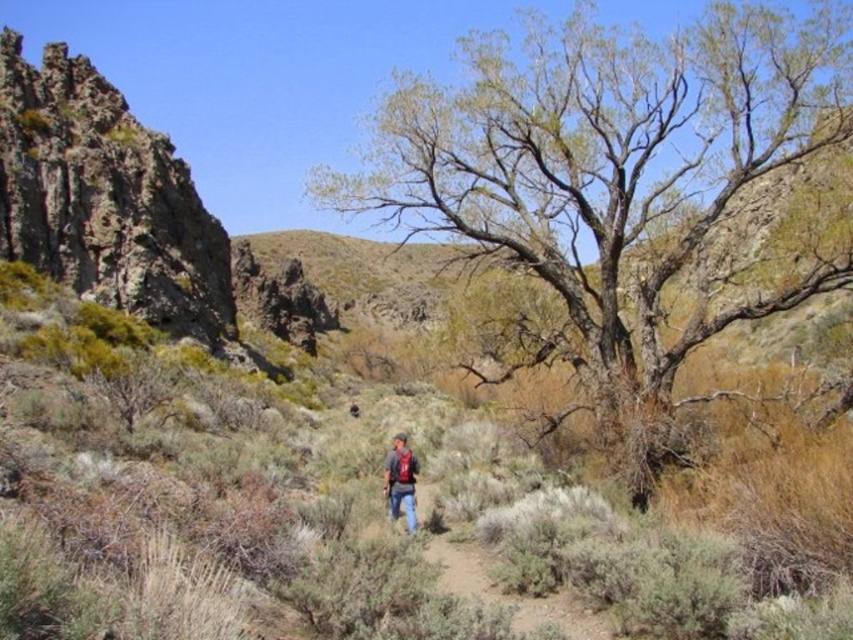
You are navigating through the desert and see two landmarks marked as point 1 at coordinates point (750, 502) and point 2 at coordinates point (515, 596). Which point is closer to your current position?

Point 1 at coordinates point (750, 502) is closer to your current position because it is in front of point 2 at coordinates point (515, 596).

You are standing at the viewpoint in the image and want to reach a specific point marked as point (175, 438). If your walking pace is 3 miles per hour, how long will it take you to reach that point?

The distance between you and point (175, 438) is 234.62 feet. Converting this to miles, 234.62 feet is approximately 0.0444 miles. At a walking pace of 3 mph, the time required is roughly 0.0444 miles divided by 3 mph, which equals about 0.0148 hours. Converting hours to minutes, this is approximately 0.89 minutes or roughly 53 seconds. Therefore, it would take approximately 53 seconds to reach point (175, 438).

You are a hiker who has just found a denim jacket at center and a green rough bark tree at center in the middle of a desert path. Which object would cast a longer shadow at noon?

The green rough bark tree at center is bigger than the denim jacket at center, so it would cast a longer shadow at noon.